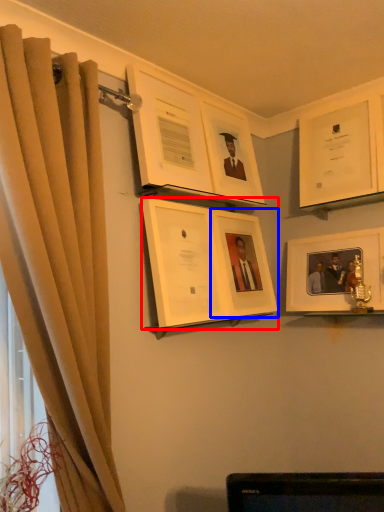
Question: Which object appears farthest to the camera in this image, picture frame (highlighted by a red box) or picture frame (highlighted by a blue box)?

Choices:
 (A) picture frame
 (B) picture frame

Answer: (B)